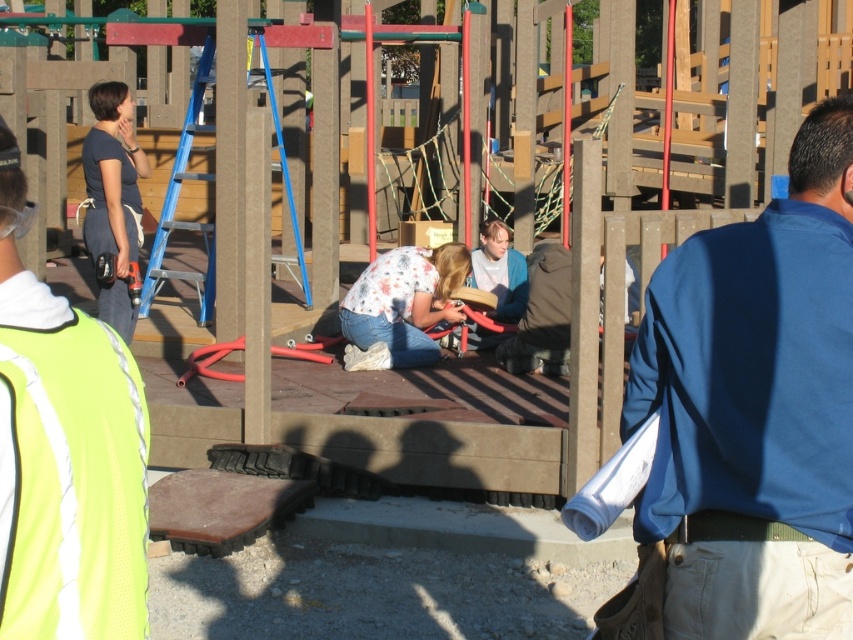
Is neon yellow mesh safety vest at left positioned before dark blue shirt at left?

Yes, it is in front of dark blue shirt at left.

Which is below, neon yellow mesh safety vest at left or dark blue shirt at left?

neon yellow mesh safety vest at left is lower down.

Is point (112, 534) closer to viewer compared to point (108, 209)?

Yes.

What are the coordinates of `neon yellow mesh safety vest at left` in the screenshot? It's located at (74, 484).

Is blue fabric shirt at center thinner than dark blue shirt at left?

In fact, blue fabric shirt at center might be wider than dark blue shirt at left.

Who is positioned more to the right, blue fabric shirt at center or dark blue shirt at left?

From the viewer's perspective, blue fabric shirt at center appears more on the right side.

Which is behind, point (836, 140) or point (132, 148)?

The point (132, 148) is more distant.

The width and height of the screenshot is (853, 640). Find the location of `blue fabric shirt at center`. blue fabric shirt at center is located at coordinates (755, 408).

In the scene shown: Can you confirm if dark blue shirt at left is smaller than floral fabric shirt at center?

Actually, dark blue shirt at left might be larger than floral fabric shirt at center.

Is point (131, 148) farther from camera compared to point (399, 316)?

No, (131, 148) is in front of (399, 316).

Locate an element on the screen. Image resolution: width=853 pixels, height=640 pixels. dark blue shirt at left is located at coordinates (113, 196).